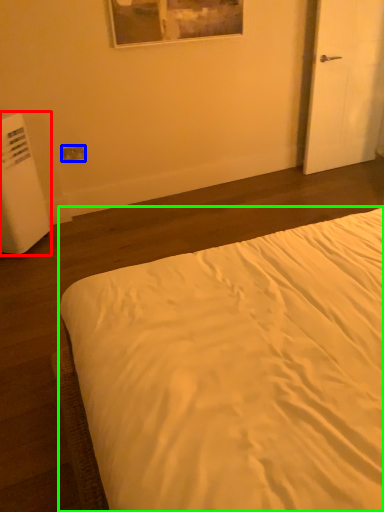
Question: Which object is positioned closest to water heater (highlighted by a red box)? Select from electric outlet (highlighted by a blue box) and bed (highlighted by a green box).

Choices:
 (A) electric outlet
 (B) bed

Answer: (A)